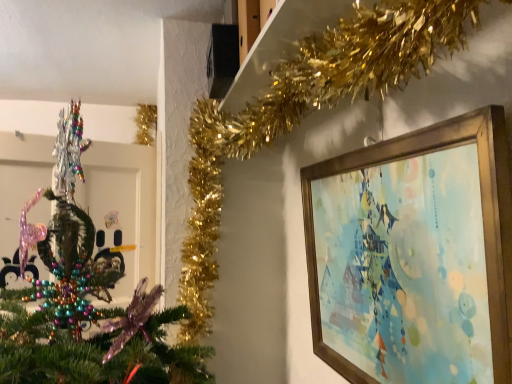
I want to click on wooden picture frame at upper right, so pos(413,252).

Measure the distance between point [449,352] and camera.

A distance of 71.80 centimeters exists between point [449,352] and camera.

What do you see at coordinates (413, 252) in the screenshot? The image size is (512, 384). I see `wooden picture frame at upper right` at bounding box center [413, 252].

You are a GUI agent. You are given a task and a screenshot of the screen. Output one action in this format:
    pyautogui.click(x=<x>, y=<y>)
    Task: Click on the wooden picture frame at upper right
    
    Given the screenshot: What is the action you would take?
    pyautogui.click(x=413, y=252)